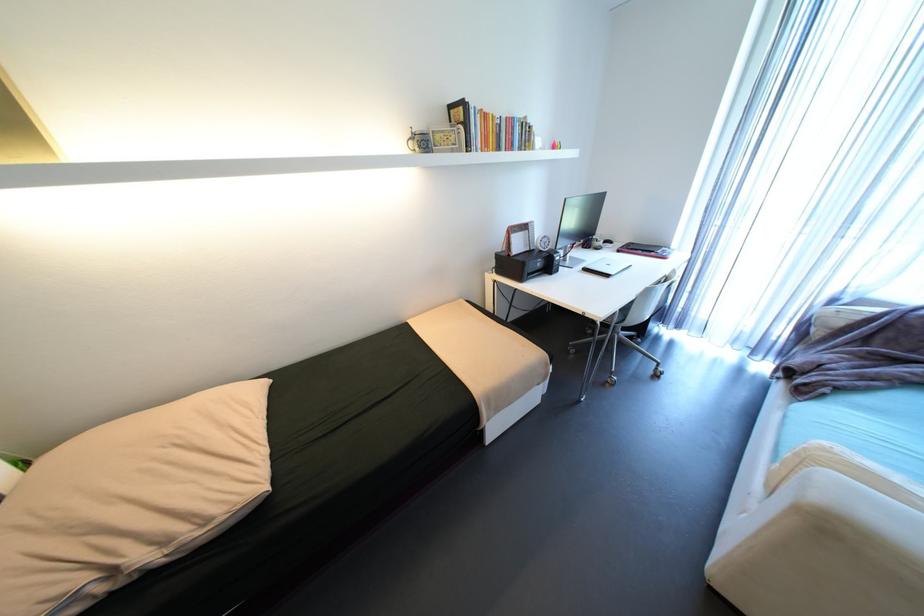
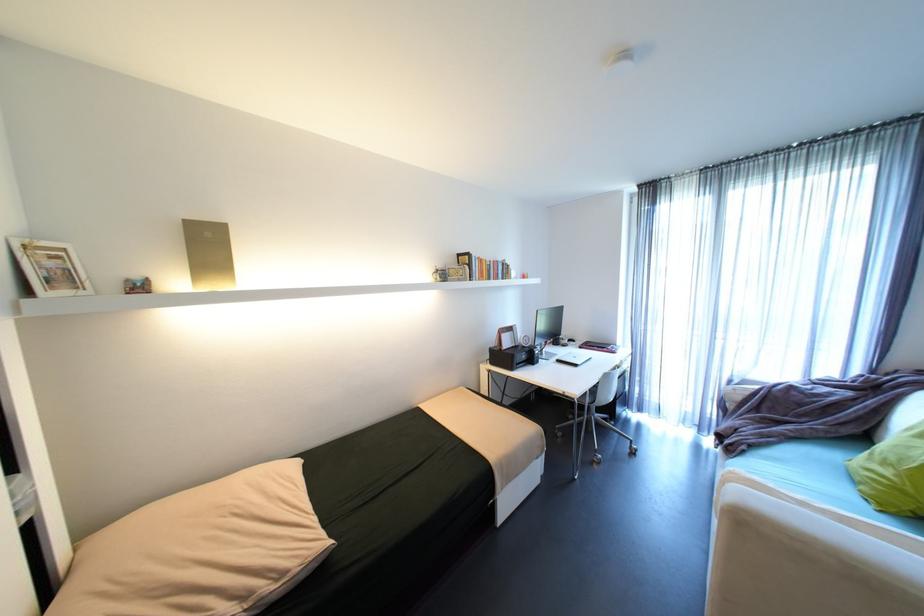
Find the pixel in the second image that matches pixel 832 395 in the first image.

(751, 451)